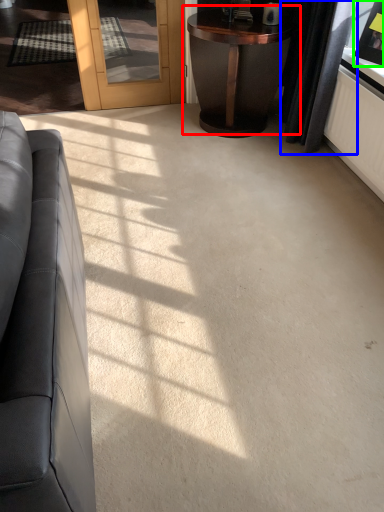
Question: Considering the real-world distances, which object is farthest from table (highlighted by a red box)? curtain (highlighted by a blue box) or picture frame (highlighted by a green box)?

Choices:
 (A) curtain
 (B) picture frame

Answer: (B)